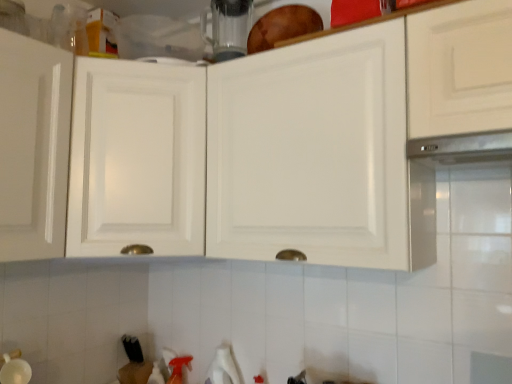
Consider the image. In order to face transparent glass blender at upper center, should I rotate leftwards or rightwards?

Turn left by 3.062 degrees to look at transparent glass blender at upper center.

Measure the distance between transparent glass blender at upper center and camera.

The distance of transparent glass blender at upper center from camera is 5.27 feet.

The width and height of the screenshot is (512, 384). I want to click on white glossy cabinet at upper center, the first cabinetry from the left, so [137, 158].

This screenshot has width=512, height=384. I want to click on white glossy cabinet at upper center, marked as the second cabinetry in a left-to-right arrangement, so click(317, 155).

The width and height of the screenshot is (512, 384). What are the coordinates of `transparent glass blender at upper center` in the screenshot? It's located at (228, 28).

Considering their positions, is white glossy cabinet at upper center, the second cabinetry viewed from the right, located in front of or behind white glossy cabinet at upper center, marked as the second cabinetry in a left-to-right arrangement?

white glossy cabinet at upper center, the second cabinetry viewed from the right, is positioned farther from the viewer than white glossy cabinet at upper center, marked as the second cabinetry in a left-to-right arrangement.

From the picture: From the image's perspective, between white glossy cabinet at upper center, the first cabinetry from the left, and white glossy cabinet at upper center, marked as the second cabinetry in a left-to-right arrangement, which one is located above?

white glossy cabinet at upper center, marked as the second cabinetry in a left-to-right arrangement.

Considering the sizes of objects white glossy cabinet at upper center, the first cabinetry from the left, and white glossy cabinet at upper center, placed as the first cabinetry when sorted from right to left, in the image provided, who is smaller, white glossy cabinet at upper center, the first cabinetry from the left, or white glossy cabinet at upper center, placed as the first cabinetry when sorted from right to left,?

Smaller between the two is white glossy cabinet at upper center, placed as the first cabinetry when sorted from right to left.

Which of these two, white glossy cabinet at upper center, placed as the first cabinetry when sorted from right to left, or white glossy cabinet at upper center, the first cabinetry from the left, is wider?

With larger width is white glossy cabinet at upper center, the first cabinetry from the left.

Is white glossy cabinet at upper center, marked as the second cabinetry in a left-to-right arrangement, at the left side of white glossy cabinet at upper center, the first cabinetry from the left?

No, white glossy cabinet at upper center, marked as the second cabinetry in a left-to-right arrangement, is not to the left of white glossy cabinet at upper center, the first cabinetry from the left.

From the image's perspective, would you say white glossy cabinet at upper center, placed as the first cabinetry when sorted from right to left, is positioned over white glossy cabinet at upper center, the first cabinetry from the left?

Yes.

Which is less distant, [120,164] or [204,12]?

Point [120,164] appears to be closer to the viewer than point [204,12].

At what (x,y) coordinates should I click in order to perform the action: click on cabinetry on the left of transparent glass blender at upper center. Please return your answer as a coordinate pair (x, y). Looking at the image, I should click on (137, 158).

From a real-world perspective, which is physically above, white glossy cabinet at upper center, the first cabinetry from the left, or transparent glass blender at upper center?

In real-world perspective, transparent glass blender at upper center is above.

From the image's perspective, is white glossy cabinet at upper center, marked as the second cabinetry in a left-to-right arrangement, above or below satin metallic exhaust hood at upper right?

From the image's perspective, white glossy cabinet at upper center, marked as the second cabinetry in a left-to-right arrangement, appears below satin metallic exhaust hood at upper right.

Is white glossy cabinet at upper center, marked as the second cabinetry in a left-to-right arrangement, taller or shorter than satin metallic exhaust hood at upper right?

white glossy cabinet at upper center, marked as the second cabinetry in a left-to-right arrangement, is taller than satin metallic exhaust hood at upper right.

Considering the sizes of objects white glossy cabinet at upper center, placed as the first cabinetry when sorted from right to left, and satin metallic exhaust hood at upper right in the image provided, who is thinner, white glossy cabinet at upper center, placed as the first cabinetry when sorted from right to left, or satin metallic exhaust hood at upper right?

white glossy cabinet at upper center, placed as the first cabinetry when sorted from right to left.

Identify the location of exhaust hood on the right of white glossy cabinet at upper center, marked as the second cabinetry in a left-to-right arrangement. The height and width of the screenshot is (384, 512). (462, 148).

Can you confirm if transparent glass blender at upper center is taller than satin metallic exhaust hood at upper right?

Yes.

In terms of width, does transparent glass blender at upper center look wider or thinner when compared to satin metallic exhaust hood at upper right?

Considering their sizes, transparent glass blender at upper center looks slimmer than satin metallic exhaust hood at upper right.

Does transparent glass blender at upper center come in front of satin metallic exhaust hood at upper right?

No.

Does transparent glass blender at upper center have a larger size compared to satin metallic exhaust hood at upper right?

Indeed, transparent glass blender at upper center has a larger size compared to satin metallic exhaust hood at upper right.

Considering the relative sizes of white glossy cabinet at upper center, marked as the second cabinetry in a left-to-right arrangement, and transparent glass blender at upper center in the image provided, is white glossy cabinet at upper center, marked as the second cabinetry in a left-to-right arrangement, wider than transparent glass blender at upper center?

Indeed, white glossy cabinet at upper center, marked as the second cabinetry in a left-to-right arrangement, has a greater width compared to transparent glass blender at upper center.

The image size is (512, 384). I want to click on cabinetry to the right of transparent glass blender at upper center, so pyautogui.click(x=317, y=155).

From a real-world perspective, is white glossy cabinet at upper center, marked as the second cabinetry in a left-to-right arrangement, positioned above or below transparent glass blender at upper center?

In terms of real-world spatial position, white glossy cabinet at upper center, marked as the second cabinetry in a left-to-right arrangement, is below transparent glass blender at upper center.

Which object is positioned more to the right, white glossy cabinet at upper center, placed as the first cabinetry when sorted from right to left, or transparent glass blender at upper center?

From the viewer's perspective, white glossy cabinet at upper center, placed as the first cabinetry when sorted from right to left, appears more on the right side.

Considering the positions of points (411, 142) and (255, 74), is point (411, 142) farther from camera compared to point (255, 74)?

No.

Considering the positions of objects satin metallic exhaust hood at upper right and white glossy cabinet at upper center, placed as the first cabinetry when sorted from right to left, in the image provided, who is more to the left, satin metallic exhaust hood at upper right or white glossy cabinet at upper center, placed as the first cabinetry when sorted from right to left,?

white glossy cabinet at upper center, placed as the first cabinetry when sorted from right to left.

From the image's perspective, which is above, satin metallic exhaust hood at upper right or white glossy cabinet at upper center, placed as the first cabinetry when sorted from right to left?

satin metallic exhaust hood at upper right appears higher in the image.

Which of these two, satin metallic exhaust hood at upper right or white glossy cabinet at upper center, marked as the second cabinetry in a left-to-right arrangement, stands shorter?

With less height is satin metallic exhaust hood at upper right.

Locate an element on the screen. cabinetry behind the white glossy cabinet at upper center, marked as the second cabinetry in a left-to-right arrangement is located at coordinates (137, 158).

The width and height of the screenshot is (512, 384). What are the coordinates of `cabinetry below the white glossy cabinet at upper center, the second cabinetry viewed from the right (from a real-world perspective)` in the screenshot? It's located at (317, 155).

From the image, which object appears to be farther from white glossy cabinet at upper center, the second cabinetry viewed from the right, white glossy cabinet at upper center, marked as the second cabinetry in a left-to-right arrangement, or satin metallic exhaust hood at upper right?

Among the two, satin metallic exhaust hood at upper right is located further to white glossy cabinet at upper center, the second cabinetry viewed from the right.

Considering their positions, is white glossy cabinet at upper center, the second cabinetry viewed from the right, positioned closer to transparent glass blender at upper center than satin metallic exhaust hood at upper right?

white glossy cabinet at upper center, the second cabinetry viewed from the right, lies closer to transparent glass blender at upper center than the other object.

Which object lies nearer to the anchor point white glossy cabinet at upper center, the first cabinetry from the left, transparent glass blender at upper center or satin metallic exhaust hood at upper right?

transparent glass blender at upper center is positioned closer to the anchor white glossy cabinet at upper center, the first cabinetry from the left.

Looking at the image, which one is located closer to white glossy cabinet at upper center, placed as the first cabinetry when sorted from right to left, transparent glass blender at upper center or satin metallic exhaust hood at upper right?

satin metallic exhaust hood at upper right lies closer to white glossy cabinet at upper center, placed as the first cabinetry when sorted from right to left, than the other object.

From the image, which object appears to be farther from satin metallic exhaust hood at upper right, white glossy cabinet at upper center, the second cabinetry viewed from the right, or white glossy cabinet at upper center, marked as the second cabinetry in a left-to-right arrangement?

white glossy cabinet at upper center, the second cabinetry viewed from the right, lies further to satin metallic exhaust hood at upper right than the other object.

When comparing their distances from satin metallic exhaust hood at upper right, does white glossy cabinet at upper center, placed as the first cabinetry when sorted from right to left, or transparent glass blender at upper center seem closer?

white glossy cabinet at upper center, placed as the first cabinetry when sorted from right to left, is positioned closer to the anchor satin metallic exhaust hood at upper right.

Looking at the image, which one is located further to white glossy cabinet at upper center, marked as the second cabinetry in a left-to-right arrangement, white glossy cabinet at upper center, the first cabinetry from the left, or transparent glass blender at upper center?

transparent glass blender at upper center.

Based on their spatial positions, is satin metallic exhaust hood at upper right or white glossy cabinet at upper center, the first cabinetry from the left, closer to white glossy cabinet at upper center, placed as the first cabinetry when sorted from right to left?

white glossy cabinet at upper center, the first cabinetry from the left, is positioned closer to the anchor white glossy cabinet at upper center, placed as the first cabinetry when sorted from right to left.

Identify the location of cabinetry between transparent glass blender at upper center and satin metallic exhaust hood at upper right in the horizontal direction. The height and width of the screenshot is (384, 512). (317, 155).

Find the location of a particular element. Image resolution: width=512 pixels, height=384 pixels. cabinetry located between white glossy cabinet at upper center, the first cabinetry from the left, and satin metallic exhaust hood at upper right in the left-right direction is located at coordinates (317, 155).

At what (x,y) coordinates should I click in order to perform the action: click on appliance between white glossy cabinet at upper center, the second cabinetry viewed from the right, and white glossy cabinet at upper center, marked as the second cabinetry in a left-to-right arrangement, from left to right. Please return your answer as a coordinate pair (x, y). This screenshot has width=512, height=384. Looking at the image, I should click on (228, 28).

Where is `appliance located between white glossy cabinet at upper center, the first cabinetry from the left, and satin metallic exhaust hood at upper right in the left-right direction`? This screenshot has width=512, height=384. appliance located between white glossy cabinet at upper center, the first cabinetry from the left, and satin metallic exhaust hood at upper right in the left-right direction is located at coordinates (228, 28).